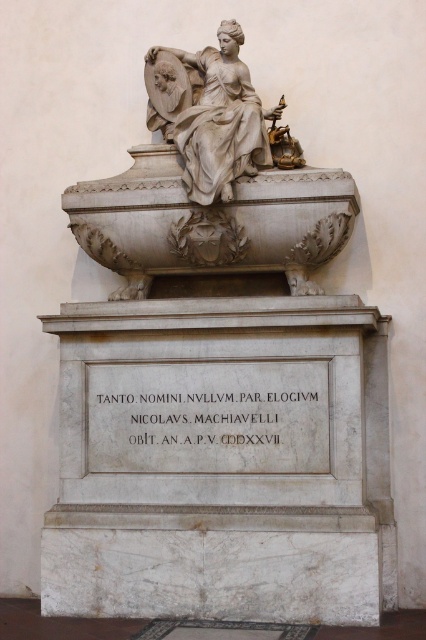
Can you confirm if white marble statue at center is taller than white marble statue at upper center?

Yes, white marble statue at center is taller than white marble statue at upper center.

Does white marble statue at center appear under white marble statue at upper center?

Correct, white marble statue at center is located below white marble statue at upper center.

This screenshot has width=426, height=640. In order to click on white marble statue at center in this screenshot , I will do `click(212, 182)`.

This screenshot has height=640, width=426. In order to click on white marble statue at center in this screenshot , I will do `click(212, 182)`.